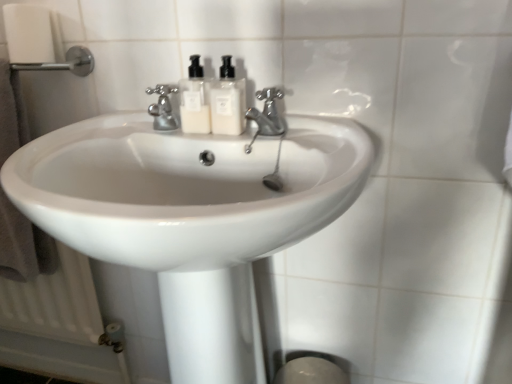
Question: Is white glossy sink at center spatially inside brushed metal towel bar at upper left, or outside of it?

Choices:
 (A) outside
 (B) inside

Answer: (A)

Question: Based on their positions, is white glossy sink at center located to the left or right of brushed metal towel bar at upper left?

Choices:
 (A) left
 (B) right

Answer: (B)

Question: Which object is the closest to the white glossy soap dispenser at center, which is the second soap dispenser in left-to-right order?

Choices:
 (A) satin nickel faucet at center, which appears as the second tap when viewed from the left
 (B) brushed metal towel bar at upper left
 (C) white plastic soap dispenser at center, which is the second soap dispenser in right-to-left order
 (D) brown towel at left
 (E) white glossy sink at center

Answer: (C)

Question: Based on their relative distances, which object is nearer to the brown towel at left?

Choices:
 (A) brushed metal towel bar at upper left
 (B) white cardboard toilet paper at upper left
 (C) white plastic soap dispenser at center, which is the second soap dispenser in right-to-left order
 (D) satin nickel faucet at center, which is the 1th tap from right to left
 (E) polished chrome faucet at center, which is counted as the 2th tap, starting from the right

Answer: (A)